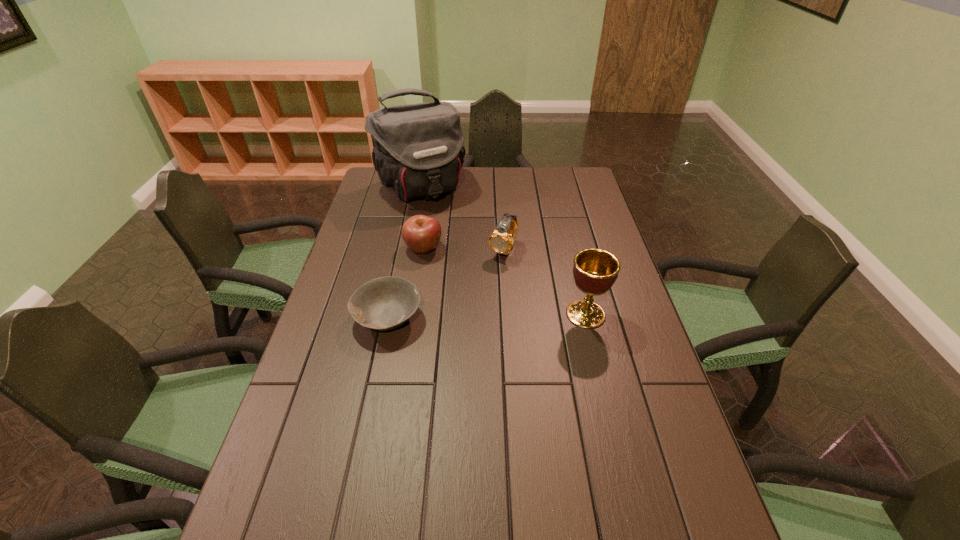
Image resolution: width=960 pixels, height=540 pixels. What are the coordinates of `vacant spot on the desktop that is between the shortest object and the rightmost object and is positioned on the face of the watch` in the screenshot? It's located at (462, 316).

Identify the location of vacant spot on the desktop that is between the shortest object and the fourth shortest object and is positioned on the open flap of the farthest object. This screenshot has height=540, width=960. (500, 316).

What are the coordinates of `free spot on the desktop that is between the shortest object and the fourth shortest object and is positioned on the side of the apple with the unique marking` in the screenshot? It's located at (501, 316).